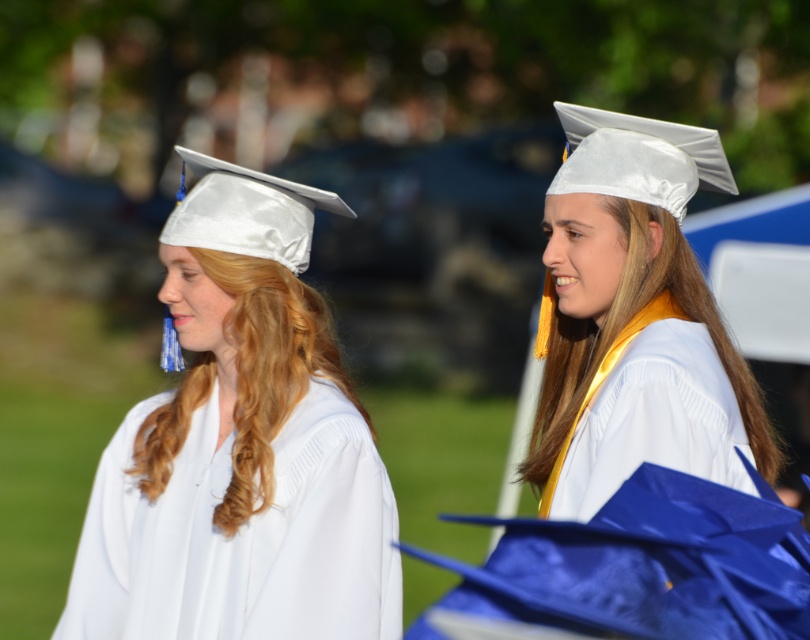
You are a photographer at a graduation ceremony. You need to adjust your camera to focus on the white satin graduation gown at center. Which direction should you move your focus point to ensure the white satin graduation cap at left is also in the frame?

The white satin graduation cap at left is to the left of white satin graduation gown at center. To include both in the frame, move the focus point slightly to the left so that the white satin graduation gown at center remains centered while the white satin graduation cap at left stays within the frame.

You are a photographer who wants to ensure that both the white satin graduation cap at center and the white satin graduation gown at center are in focus for a closeup shot. Given that your camera has a depth of field of 2 inches, will you be able to capture both items clearly in the same frame?

The white satin graduation cap at center is 2.23 inches away from the white satin graduation gown at center. Since the distance between them exceeds the camera lens depth of field of 2 inches, capturing both in focus simultaneously would be challenging. The photographer may need to adjust the focus or use a different lens to ensure both items are sharp.